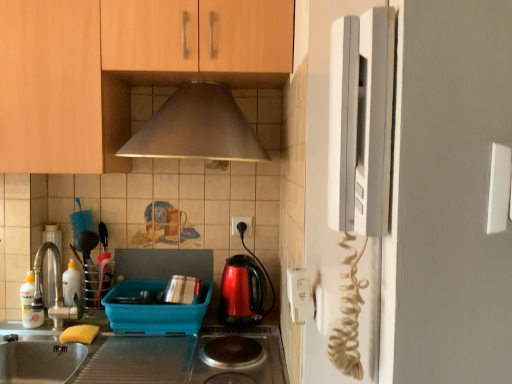
This screenshot has width=512, height=384. In order to click on blank area beneath shiny plastic kettle at center (from a real-world perspective) in this screenshot , I will do `click(244, 319)`.